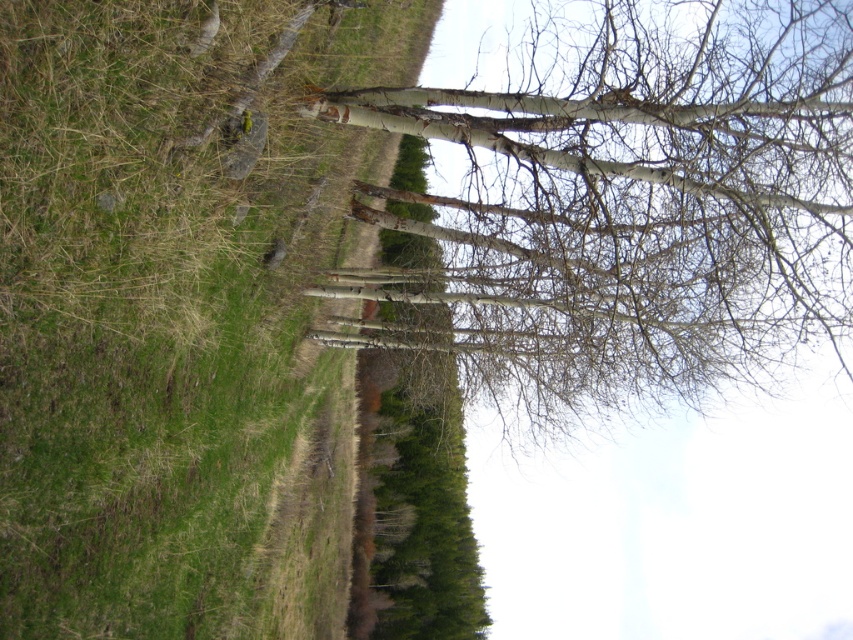
Can you confirm if green grass at upper left is bigger than white bark tree at center?

Actually, green grass at upper left might be smaller than white bark tree at center.

Does green grass at upper left appear on the left side of white bark tree at center?

Indeed, green grass at upper left is positioned on the left side of white bark tree at center.

The height and width of the screenshot is (640, 853). Find the location of `green grass at upper left`. green grass at upper left is located at coordinates (160, 298).